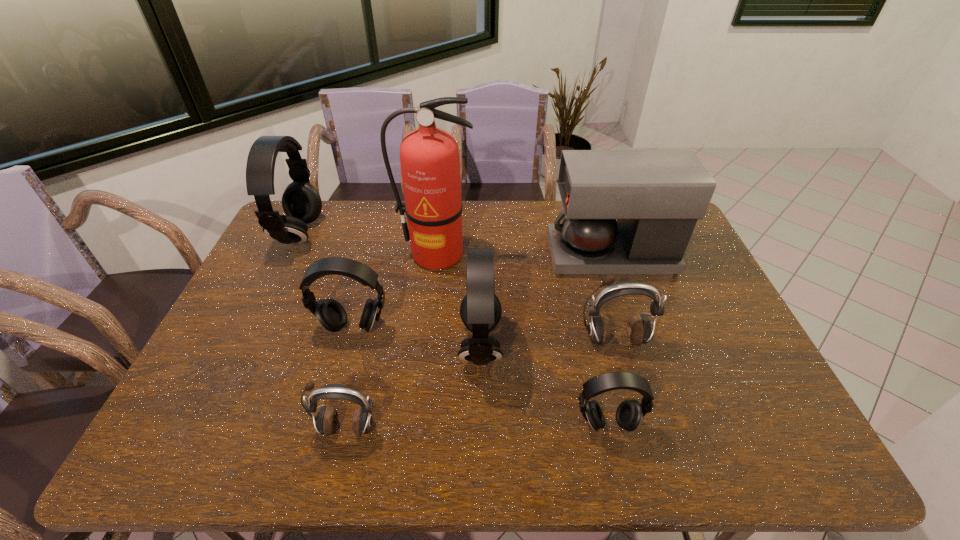
Where is `object present at the far left corner`? The image size is (960, 540). object present at the far left corner is located at coordinates (301, 202).

At what (x,y) coordinates should I click in order to perform the action: click on object that is positioned at the far right corner. Please return your answer as a coordinate pair (x, y). This screenshot has height=540, width=960. Looking at the image, I should click on point(657,196).

The height and width of the screenshot is (540, 960). What are the coordinates of `free space at the far edge` in the screenshot? It's located at (365, 227).

You are a GUI agent. You are given a task and a screenshot of the screen. Output one action in this format:
    pyautogui.click(x=<x>, y=<y>)
    Task: Click on the vacant space at the near edge of the desktop
    The image size is (960, 540).
    Given the screenshot: What is the action you would take?
    pyautogui.click(x=692, y=437)

The width and height of the screenshot is (960, 540). In order to click on vacant space at the left edge of the desktop in this screenshot , I will do `click(258, 336)`.

I want to click on free space at the right edge of the desktop, so coord(702,272).

Where is `vacant area that lies between the third black earphone from right to left and the leftmost earphone`? The height and width of the screenshot is (540, 960). vacant area that lies between the third black earphone from right to left and the leftmost earphone is located at coordinates (326, 281).

In order to click on vacant region between the left brown earphone and the fire extinguisher in this screenshot , I will do `click(391, 341)`.

Find the location of a particular element. This screenshot has height=540, width=960. vacant space that is in between the rightmost black earphone and the coffee maker is located at coordinates (609, 340).

Find the location of a particular element. The image size is (960, 540). vacant area that lies between the nearest black earphone and the third smallest black earphone is located at coordinates (543, 384).